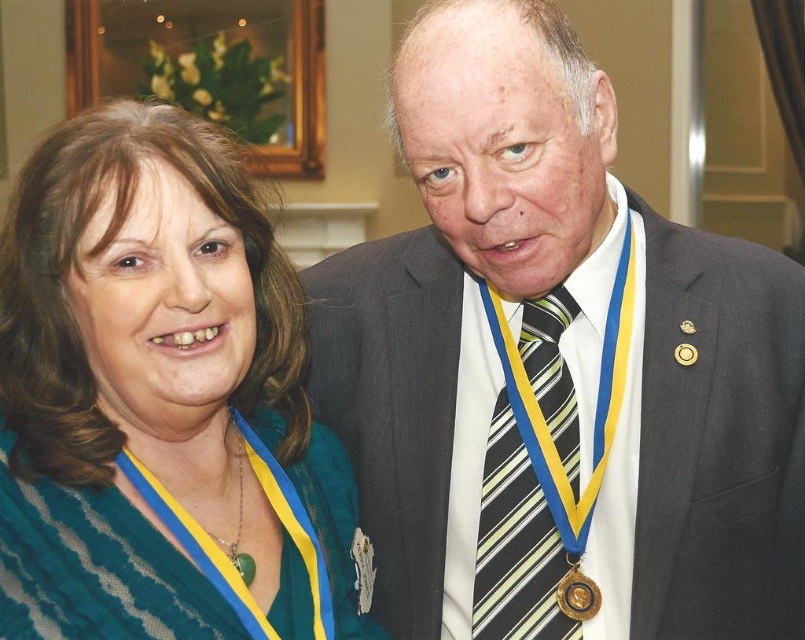
You are organizing a charity event and need to determine which item takes up more space between the matte gray suit at center and the striped fabric tie at right. Based on the scene, which object is bigger?

The matte gray suit at center is larger in size than the striped fabric tie at right, so the matte gray suit at center takes up more space.

You are a photographer at a formal event. You need to adjust your camera to focus on the matte gray suit at center and the striped fabric tie at right. Which object should you focus on first if you want to capture both in a single shot without adjusting the focus distance?

The matte gray suit at center is much taller than the striped fabric tie at right, so focusing on the matte gray suit at center first would ensure both are in focus since it is farther away and the tie is closer.